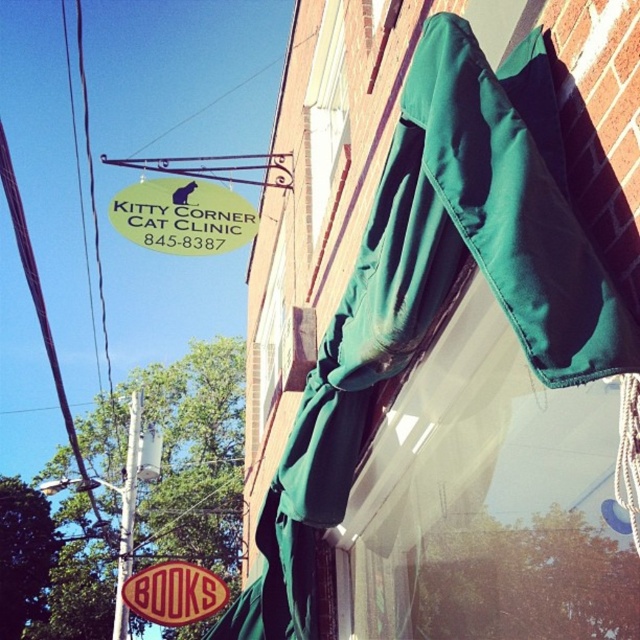
You are a window cleaner needing to clean the green fabric awning at upper right and the green fabric sign at upper left. Which object requires a longer ladder to reach its full height?

The green fabric awning at upper right requires a longer ladder because its width is larger than the green fabric sign at upper left, implying it is taller and needs more reach.

You are standing in front of the brick building with the Kitty Corner Cat Clinic sign. There are two points marked on the awning. The first point is at coordinates point [362,186] and the second point is at point [333,163]. Which point is closer to you?

Point [362,186] is in front of point [333,163], so the first point is closer to you.